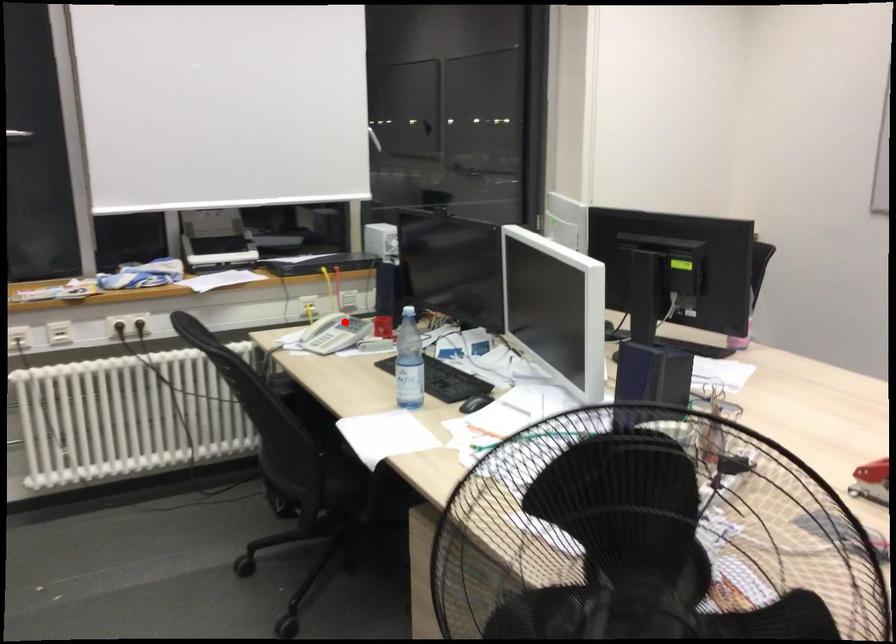
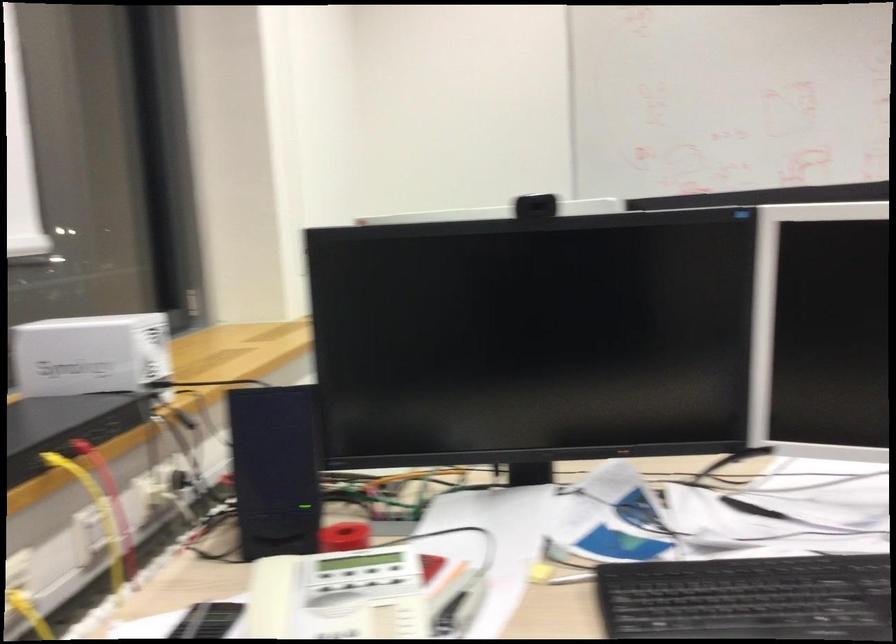
Question: A red point is marked in image1. In image2, is the corresponding 3D point closer to the camera or farther? Reply with the corresponding letter.

Choices:
 (A) The corresponding 3D point is closer.
 (B) The corresponding 3D point is farther.

Answer: (A)